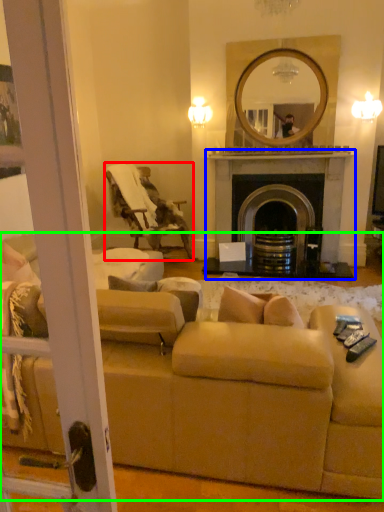
Question: Based on their relative distances, which object is nearer to chair (highlighted by a red box)? Choose from fireplace (highlighted by a blue box) and studio couch (highlighted by a green box).

Choices:
 (A) fireplace
 (B) studio couch

Answer: (A)